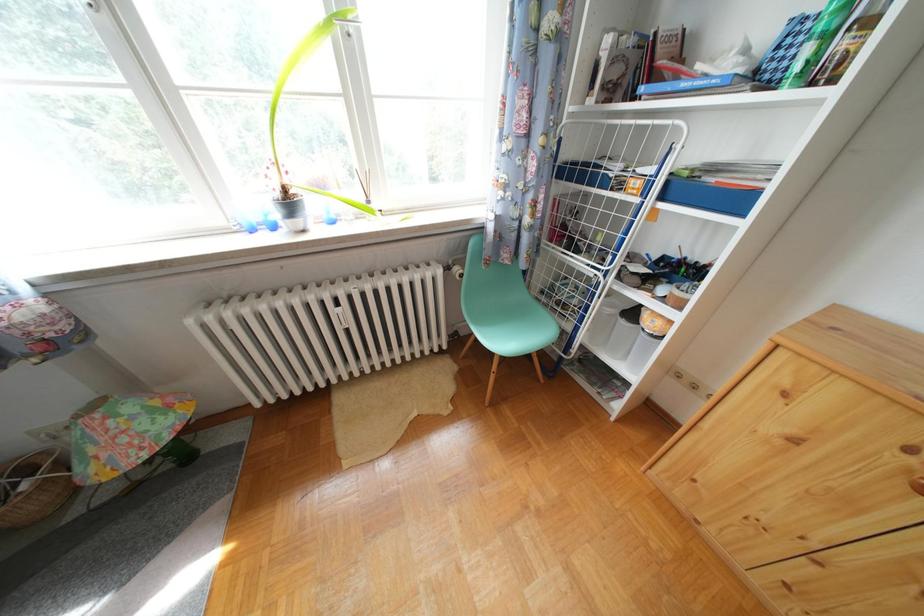
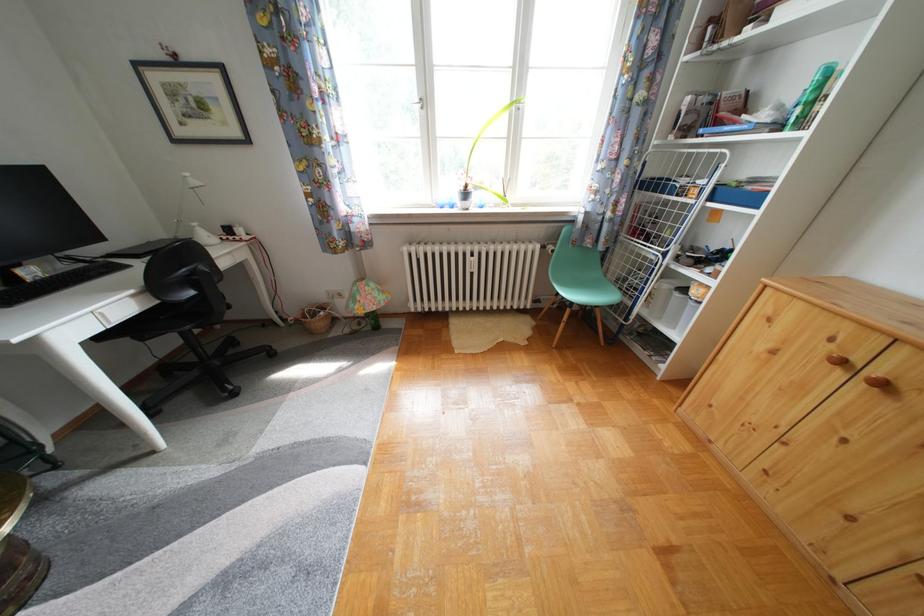
Question: How did the camera likely rotate?

Choices:
 (A) Left
 (B) Right
 (C) Up
 (D) Down

Answer: (A)